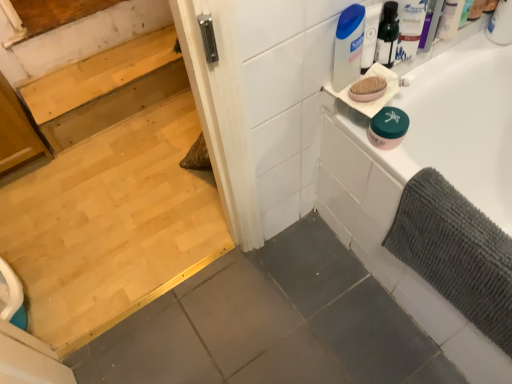
Question: Can you confirm if green matte jar at upper right is taller than white plastic container at upper right?

Choices:
 (A) yes
 (B) no

Answer: (B)

Question: Does green matte jar at upper right have a greater width compared to white plastic container at upper right?

Choices:
 (A) no
 (B) yes

Answer: (B)

Question: From a real-world perspective, is green matte jar at upper right over white plastic container at upper right?

Choices:
 (A) yes
 (B) no

Answer: (B)

Question: From a real-world perspective, is green matte jar at upper right below white plastic container at upper right?

Choices:
 (A) yes
 (B) no

Answer: (A)

Question: Is white plastic container at upper right completely or partially inside green matte jar at upper right?

Choices:
 (A) yes
 (B) no

Answer: (B)

Question: Does green matte jar at upper right lie behind white plastic container at upper right?

Choices:
 (A) no
 (B) yes

Answer: (B)

Question: Does gray textured bath mat at right appear on the left side of white plastic container at upper right?

Choices:
 (A) yes
 (B) no

Answer: (A)

Question: Would you say gray textured bath mat at right is outside white plastic container at upper right?

Choices:
 (A) no
 (B) yes

Answer: (B)

Question: Are gray textured bath mat at right and white plastic container at upper right making contact?

Choices:
 (A) no
 (B) yes

Answer: (A)

Question: Is gray textured bath mat at right not close to white plastic container at upper right?

Choices:
 (A) no
 (B) yes

Answer: (A)

Question: Does gray textured bath mat at right have a greater width compared to white plastic container at upper right?

Choices:
 (A) yes
 (B) no

Answer: (A)

Question: Can you confirm if gray textured bath mat at right is smaller than white plastic container at upper right?

Choices:
 (A) no
 (B) yes

Answer: (A)

Question: Does pink matte oval soap at upper right have a lesser height compared to green matte jar at upper right?

Choices:
 (A) no
 (B) yes

Answer: (B)